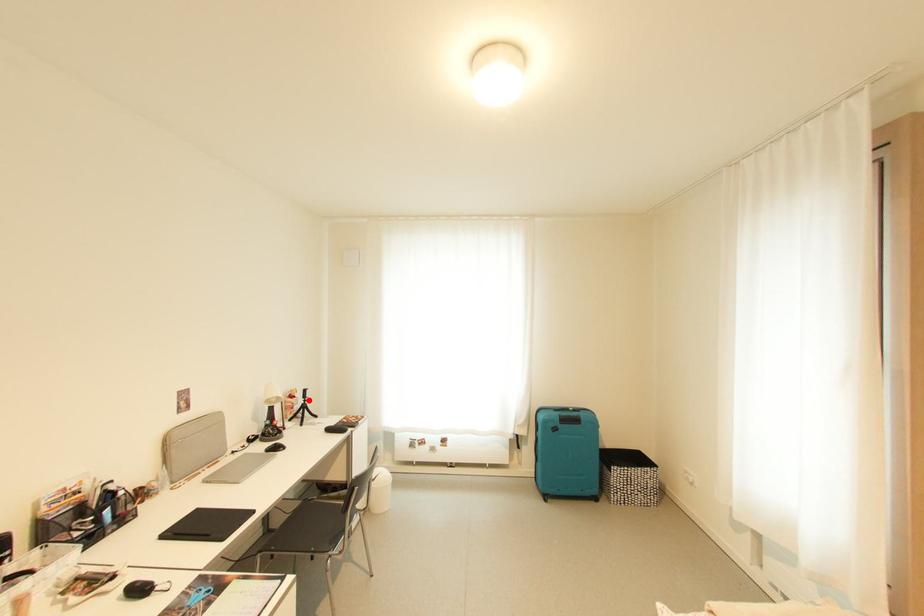
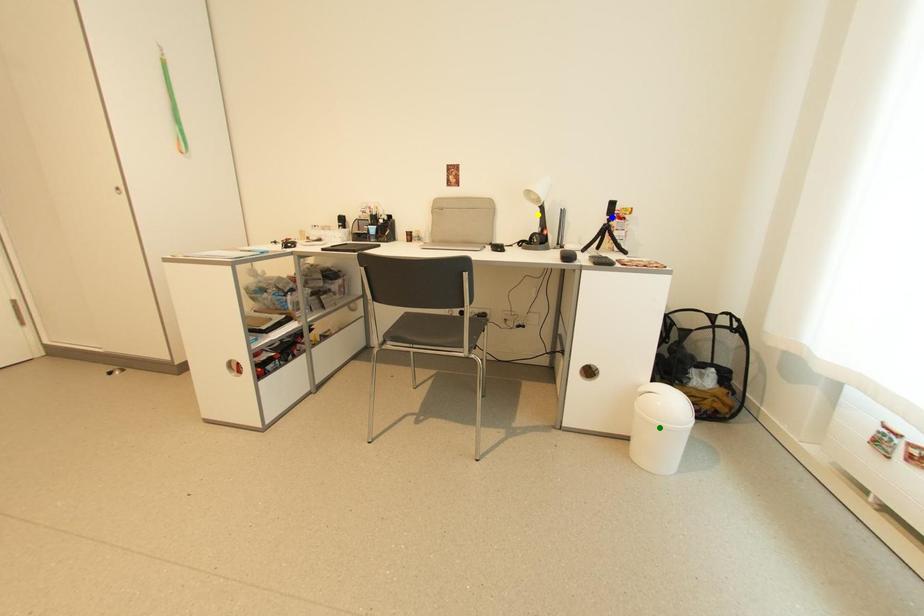
Question: I am providing you with two images of the same scene from different viewpoints. A red point is marked on the first image. You are given multiple points on the second image. Which mark in image 2 goes with the point in image 1?

Choices:
 (A) yellow point
 (B) blue point
 (C) green point

Answer: (B)